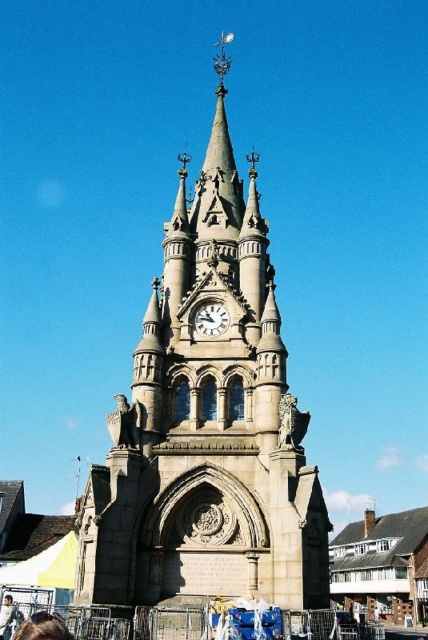
Is point (269, 358) farther from viewer compared to point (68, 632)?

That is True.

Does stone clock tower at center come behind brown hair at lower left?

Yes, it is behind brown hair at lower left.

Where is `stone clock tower at center`? The image size is (428, 640). stone clock tower at center is located at coordinates (208, 422).

What do you see at coordinates (208, 422) in the screenshot? I see `stone clock tower at center` at bounding box center [208, 422].

Is point (163, 358) in front of point (225, 323)?

Yes, point (163, 358) is closer to viewer.

What are the coordinates of `stone clock tower at center` in the screenshot? It's located at (208, 422).

What do you see at coordinates (211, 320) in the screenshot?
I see `white stone clock at center` at bounding box center [211, 320].

Who is positioned more to the left, white stone clock at center or light brown leather jacket at lower left?

From the viewer's perspective, light brown leather jacket at lower left appears more on the left side.

Does point (211, 308) lie behind point (5, 632)?

Yes, point (211, 308) is farther from viewer.

Identify the location of white stone clock at center. (211, 320).